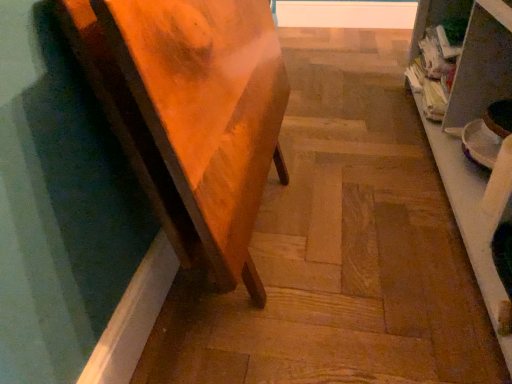
You are a GUI agent. You are given a task and a screenshot of the screen. Output one action in this format:
    pyautogui.click(x=<x>, y=<y>)
    Task: Click on the wooden table at left
    This screenshot has height=384, width=512.
    Given the screenshot: What is the action you would take?
    pyautogui.click(x=170, y=149)

What are the coordinates of `wooden step at center` in the screenshot? It's located at (341, 246).

Where is `white glossy shelf at right`? Image resolution: width=512 pixels, height=384 pixels. white glossy shelf at right is located at coordinates (464, 137).

Is wooden step at center facing away from white glossy shelf at right?

No.

Measure the distance from wooden step at center to white glossy shelf at right.

wooden step at center is 9.57 inches away from white glossy shelf at right.

Considering the positions of objects wooden step at center and white glossy shelf at right in the image provided, who is more to the left, wooden step at center or white glossy shelf at right?

Positioned to the left is wooden step at center.

Considering their positions, is wooden step at center located in front of or behind white glossy shelf at right?

Clearly, wooden step at center is behind white glossy shelf at right.

From their relative heights in the image, would you say wooden step at center is taller or shorter than wooden table at left?

In the image, wooden step at center appears to be shorter than wooden table at left.

Is point (432, 343) behind point (142, 123)?

Yes, it is.

From the image's perspective, is wooden step at center located beneath wooden table at left?

No.

Is wooden step at center situated inside wooden table at left or outside?

wooden step at center is spatially situated outside wooden table at left.

Which is behind, wooden table at left or white glossy shelf at right?

wooden table at left is further away from the camera.

Does wooden table at left have a greater width compared to white glossy shelf at right?

Incorrect, the width of wooden table at left does not surpass that of white glossy shelf at right.

Would you say white glossy shelf at right is part of wooden table at left's contents?

Definitely not — white glossy shelf at right is not inside wooden table at left.

Visually, is wooden table at left positioned to the left or to the right of white glossy shelf at right?

In the image, wooden table at left appears on the left side of white glossy shelf at right.

Is the position of white glossy shelf at right more distant than that of wooden table at left?

No.

Looking at this image, is white glossy shelf at right looking in the opposite direction of wooden table at left?

white glossy shelf at right does not have its back to wooden table at left.

Who is taller, white glossy shelf at right or wooden table at left?

wooden table at left.

Considering the sizes of white glossy shelf at right and wooden table at left in the image, is white glossy shelf at right bigger or smaller than wooden table at left?

Clearly, white glossy shelf at right is larger in size than wooden table at left.

From a real-world perspective, is white glossy shelf at right physically located above or below wooden step at center?

From a real-world perspective, white glossy shelf at right is physically above wooden step at center.

Is white glossy shelf at right directly adjacent to wooden step at center?

white glossy shelf at right is not next to wooden step at center, and they're not touching.

Between point (482, 97) and point (338, 256), which one is positioned behind?

Positioned behind is point (482, 97).

Can you confirm if white glossy shelf at right is taller than wooden step at center?

Indeed, white glossy shelf at right has a greater height compared to wooden step at center.

Based on the photo, could you tell me if wooden table at left is turned towards wooden step at center?

No, wooden table at left is not oriented towards wooden step at center.

The image size is (512, 384). Identify the location of furniture that is on the left side of wooden step at center. (170, 149).

Measure the distance from wooden table at left to wooden step at center.

wooden table at left and wooden step at center are 14.68 inches apart.

Does wooden table at left lie in front of wooden step at center?

Yes, wooden table at left is closer to the viewer.

Find the location of a particular element. The height and width of the screenshot is (384, 512). shelf below the wooden step at center (from the image's perspective) is located at coordinates (464, 137).

You are a GUI agent. You are given a task and a screenshot of the screen. Output one action in this format:
    pyautogui.click(x=<x>, y=<y>)
    Task: Click on the stair above the wooden table at left (from the image's perspective)
    The image size is (512, 384).
    Given the screenshot: What is the action you would take?
    pyautogui.click(x=341, y=246)

Which object lies further to the anchor point wooden step at center, wooden table at left or white glossy shelf at right?

wooden table at left lies further to wooden step at center than the other object.

Which object lies nearer to the anchor point wooden table at left, wooden step at center or white glossy shelf at right?

wooden step at center lies closer to wooden table at left than the other object.

From the picture: Which object lies further to the anchor point wooden table at left, white glossy shelf at right or wooden step at center?

white glossy shelf at right is further to wooden table at left.

When comparing their distances from white glossy shelf at right, does wooden table at left or wooden step at center seem further?

wooden table at left.

When comparing their distances from white glossy shelf at right, does wooden step at center or wooden table at left seem further?

wooden table at left is further to white glossy shelf at right.

Which object lies further to the anchor point wooden step at center, white glossy shelf at right or wooden table at left?

wooden table at left lies further to wooden step at center than the other object.

Where is `stair located between wooden table at left and white glossy shelf at right in the left-right direction`? The image size is (512, 384). stair located between wooden table at left and white glossy shelf at right in the left-right direction is located at coordinates (341, 246).